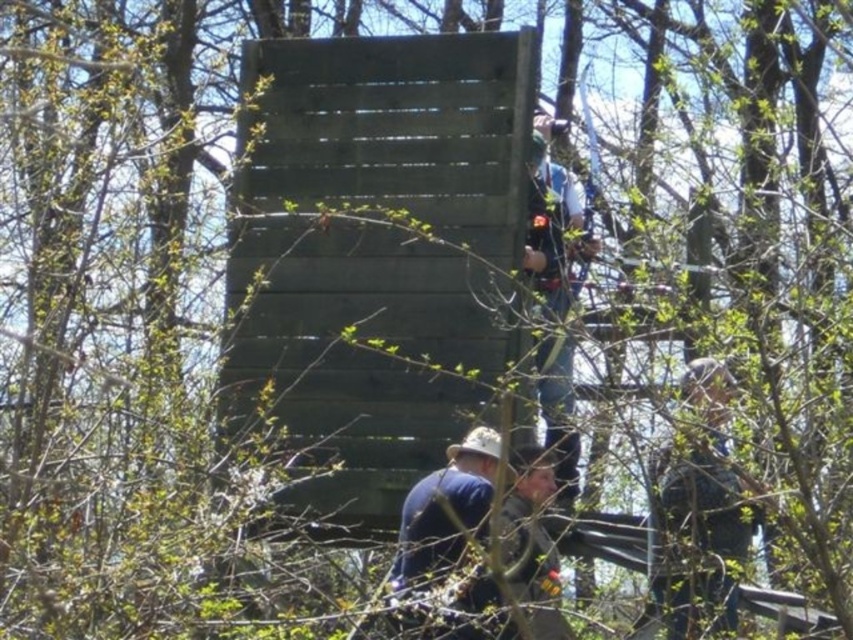
You are a photographer trying to capture a wide shot of the dark wood lift at center and the blue denim jeans at upper right. Considering their sizes, which object should you focus on first to ensure both are in frame?

The dark wood lift at center is wider than the blue denim jeans at upper right, so focusing on it first will help ensure both are in frame.

You are standing at the base of the dark wood lift at center and want to hand a tool to the person wearing the blue fabric hat at lower center. In which direction should you move to reach them?

→ The dark wood lift at center is to the left of the blue fabric hat at lower center, so you should move to your right to reach the person wearing the blue fabric hat at lower center.

You are standing at the base of the wooden structure in the image. A safety inspector has marked a point at coordinates point (x=288, y=45) on the structure. They need to know if this point is within a 30 meter safety zone. Can you confirm?

The distance of point (x=288, y=45) from viewer is 28.92 meters, which is within the 30 meter safety zone.